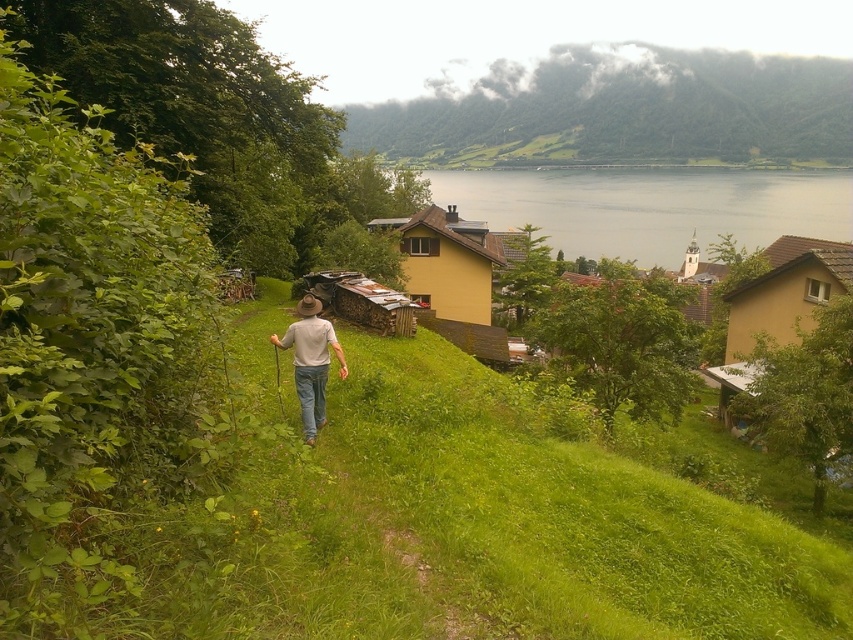
Can you confirm if yellow matte house at center is positioned to the right of light brown leather hat at center?

Correct, you'll find yellow matte house at center to the right of light brown leather hat at center.

Which is below, yellow matte house at center or light brown leather hat at center?

light brown leather hat at center is lower down.

Is point (408, 282) less distant than point (281, 339)?

No, it is behind (281, 339).

Locate an element on the screen. This screenshot has width=853, height=640. yellow matte house at center is located at coordinates (447, 260).

Who is higher up, green grassy hillside at center or yellow matte house at center?

yellow matte house at center

Which is more to the right, green grassy hillside at center or yellow matte house at center?

green grassy hillside at center

Describe the element at coordinates (439, 524) in the screenshot. I see `green grassy hillside at center` at that location.

I want to click on green grassy hillside at center, so click(x=439, y=524).

Looking at this image, does grayish water at upper center have a lesser height compared to light brown leather hat at center?

No.

Between point (585, 179) and point (312, 424), which one is positioned in front?

Point (312, 424)

Is point (793, 172) in front of point (299, 364)?

No, (793, 172) is further to viewer.

Where is `grayish water at upper center`? The height and width of the screenshot is (640, 853). grayish water at upper center is located at coordinates [650, 208].